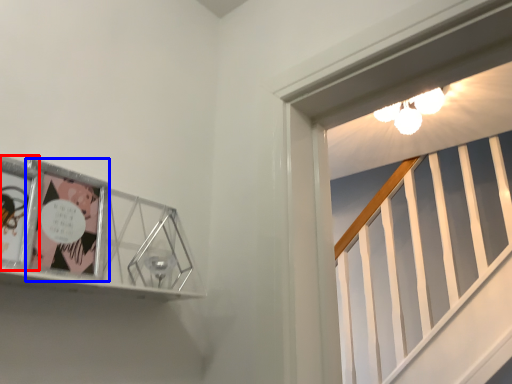
Question: Which of the following is the farthest to the observer, comic book (highlighted by a red box) or comic book (highlighted by a blue box)?

Choices:
 (A) comic book
 (B) comic book

Answer: (B)